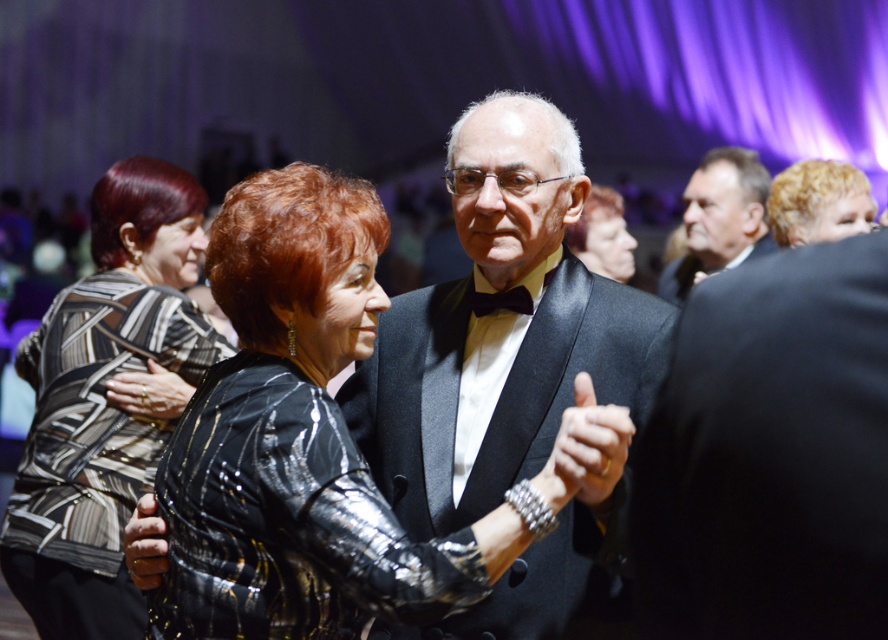
You are a photographer at the event and want to capture a closeup of the black textured dress at left and the black satin bow tie at center. Which object should you zoom in on to ensure both are in frame without moving the camera?

The black satin bow tie at center is smaller than the black textured dress at left, so you should zoom in on the black satin bow tie at center to ensure both are in frame without moving the camera.

You are standing at the origin point of the coordinate system in the image. You want to move towards the satin black suit at center. What direction should you move in to reach it?

The satin black suit at center is located at coordinate point 0.517 on the x axis and 0.563 on the y axis. Since you are at the origin, you should move towards the positive x and positive y directions to reach it.